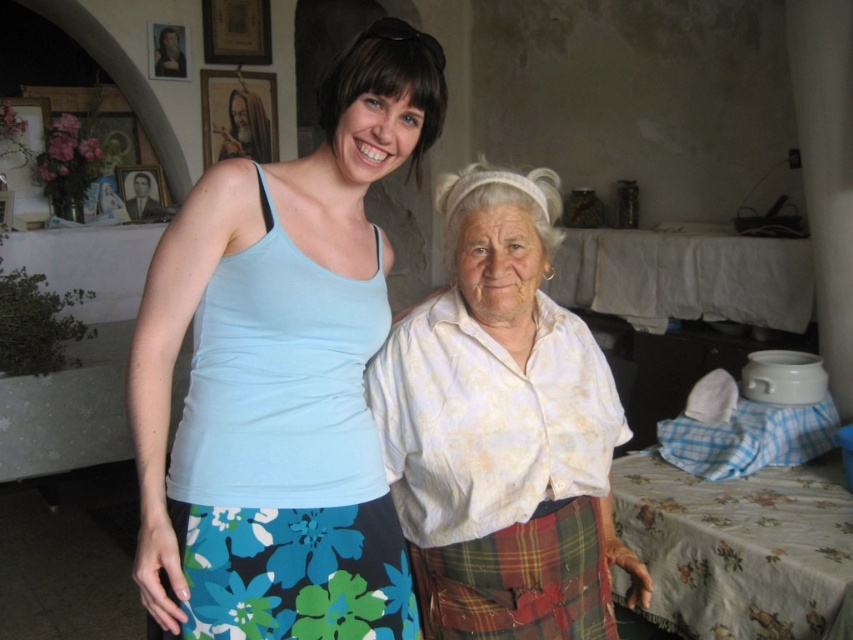
Question: Which object is closer to the camera taking this photo?

Choices:
 (A) white floral blouse at center
 (B) matte black portrait at upper left
 (C) floral fabric skirt at lower center

Answer: (A)

Question: Can you confirm if white floral blouse at center is positioned to the right of wooden frame at upper center?

Choices:
 (A) no
 (B) yes

Answer: (B)

Question: Is white textured shirt at center positioned before wooden photo frame at upper left?

Choices:
 (A) yes
 (B) no

Answer: (A)

Question: Which point is closer to the camera?

Choices:
 (A) (596, 595)
 (B) (152, 179)

Answer: (A)

Question: Which object is farther from the camera taking this photo?

Choices:
 (A) wooden frame at upper center
 (B) white cloth at center
 (C) plaid wool kilt at lower center
 (D) wooden photo frame at upper left

Answer: (D)

Question: Is floral printed fabric at lower right in front of wooden frame at upper center?

Choices:
 (A) no
 (B) yes

Answer: (B)